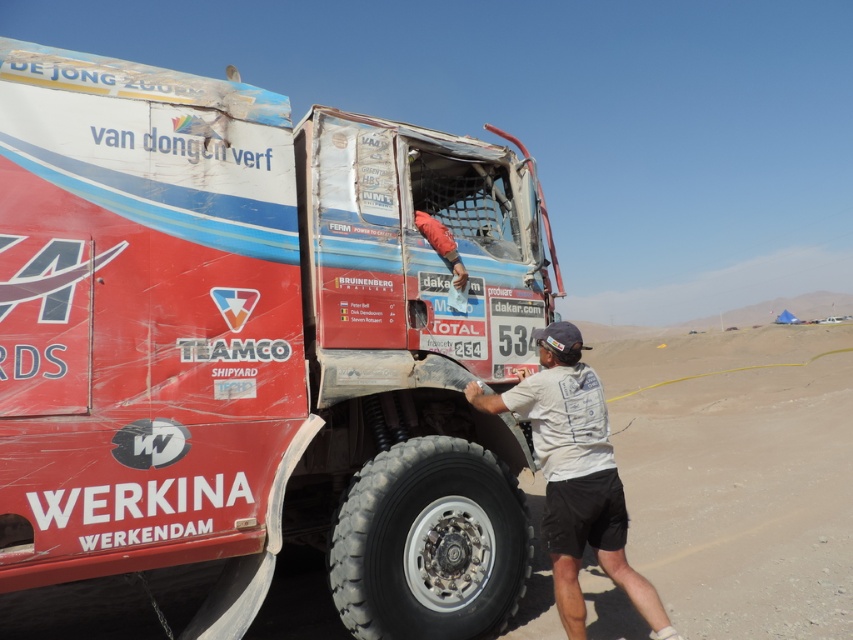
Between point (318, 323) and point (347, 580), which one is positioned behind?

The point (318, 323) is behind.

Can you confirm if scratched red truck at center is positioned to the right of black rubber tire at lower center?

Incorrect, scratched red truck at center is not on the right side of black rubber tire at lower center.

Which is behind, point (428, 490) or point (405, 513)?

Point (428, 490)

Identify the location of scratched red truck at center. (257, 344).

Looking at this image, how much distance is there between white cotton shirt at center and red fabric sleeve at upper center?

white cotton shirt at center is 1.04 meters away from red fabric sleeve at upper center.

You are a GUI agent. You are given a task and a screenshot of the screen. Output one action in this format:
    pyautogui.click(x=<x>, y=<y>)
    Task: Click on the white cotton shirt at center
    The image size is (853, 640).
    Given the screenshot: What is the action you would take?
    pyautogui.click(x=575, y=476)

Is point (573, 346) more distant than point (450, 259)?

That is False.

This screenshot has height=640, width=853. Find the location of `white cotton shirt at center`. white cotton shirt at center is located at coordinates (575, 476).

Who is more distant from viewer, (256, 602) or (445, 257)?

Positioned behind is point (445, 257).

Which of these two, scratched red truck at center or red fabric sleeve at upper center, stands taller?

scratched red truck at center is taller.

Who is more forward, (48, 164) or (447, 252)?

Point (48, 164) is more forward.

You are a GUI agent. You are given a task and a screenshot of the screen. Output one action in this format:
    pyautogui.click(x=<x>, y=<y>)
    Task: Click on the scratched red truck at center
    This screenshot has height=640, width=853.
    Given the screenshot: What is the action you would take?
    pyautogui.click(x=257, y=344)